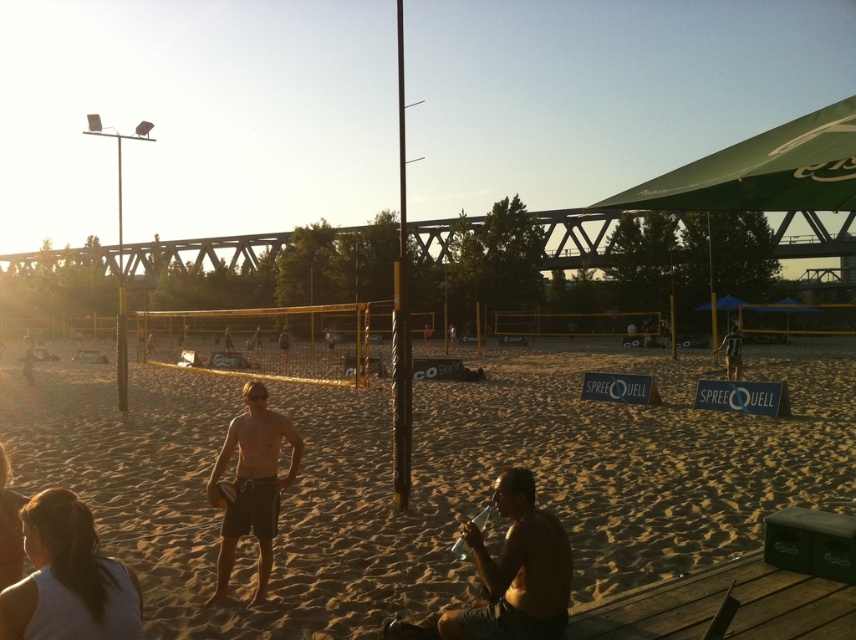
You are a photographer trying to capture a closeup shot of the yellow matte volleyball at center. You want to ensure that the light brown wooden pole at center does not block the view. Based on the scene, can you determine if the pole is wide enough to obstruct the volleyball in the shot?

The light brown wooden pole at center might be wider than yellow matte volleyball at center, so there is a possibility that the pole could block the volleyball in the shot.

You are a photographer standing at the edge of the volleyball court. You want to take a photo of the yellow matte volleyball at center without the light brown wooden pole at center blocking it. What should you do?

Move the yellow matte volleyball at center to a position where it is not under the light brown wooden pole at center, as the pole is currently positioned over the volleyball, blocking the view.

You are a photographer trying to capture a wide shot of the volleyball game. You notice the brown sandy beach at center and the yellow matte volleyball at center in your frame. Which object should you focus on to ensure both are visible but emphasize the larger one?

You should focus on the brown sandy beach at center since it has a larger size compared to the yellow matte volleyball at center, allowing both to be visible while emphasizing the larger object.